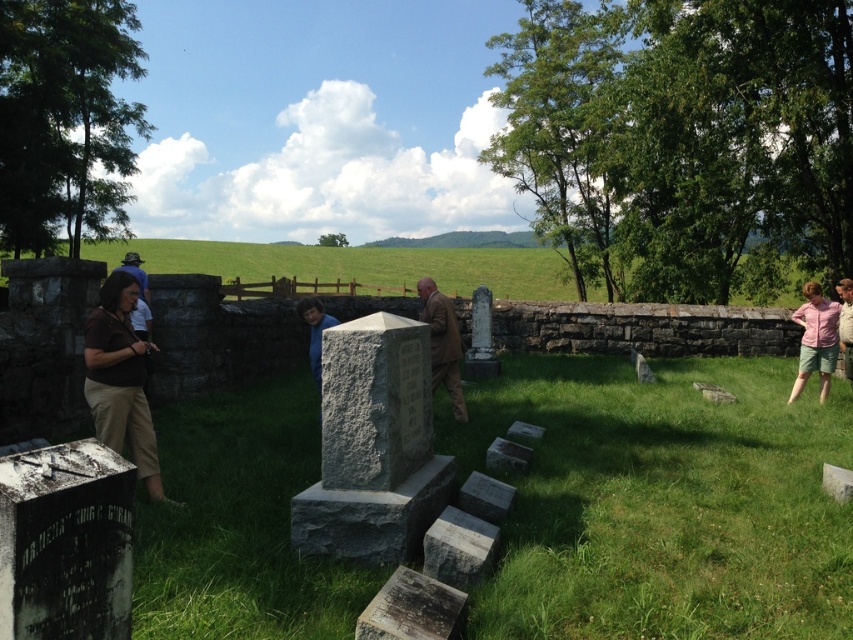
Question: Is green grassy field at center smaller than brown wool coat at center?

Choices:
 (A) no
 (B) yes

Answer: (A)

Question: Which of these objects is positioned closest to the pink cotton shirt at right?

Choices:
 (A) green grassy field at center
 (B) brown wool coat at center

Answer: (B)

Question: Which of the following is the farthest from the observer?

Choices:
 (A) (692, 300)
 (B) (442, 336)

Answer: (A)

Question: Which is farther from the pink cotton shirt at right?

Choices:
 (A) brown wool coat at center
 (B) green grassy field at center

Answer: (B)

Question: Does green grassy field at center appear on the right side of brown wool coat at center?

Choices:
 (A) yes
 (B) no

Answer: (B)

Question: Does green grassy field at center appear over brown wool coat at center?

Choices:
 (A) no
 (B) yes

Answer: (B)